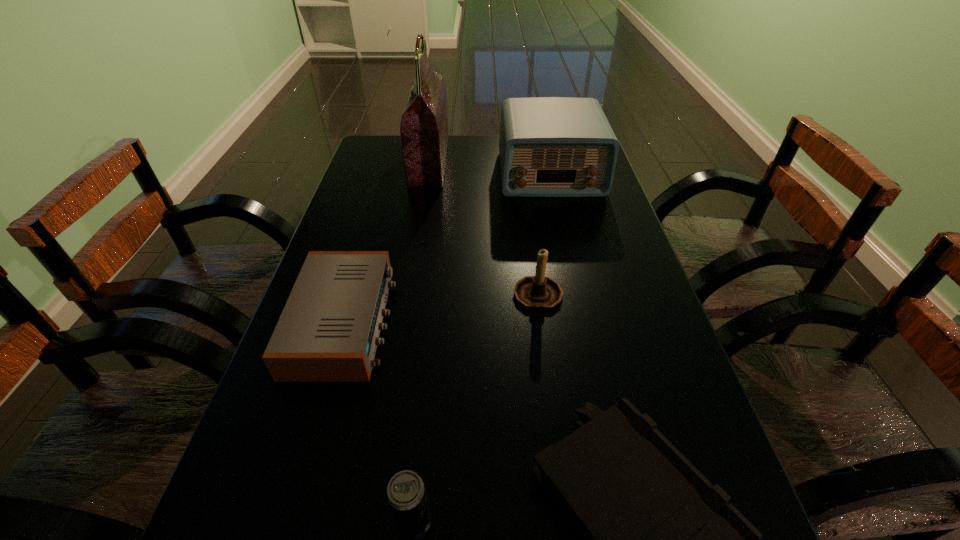
You are a GUI agent. You are given a task and a screenshot of the screen. Output one action in this format:
    pyautogui.click(x=<x>, y=<y>)
    Task: Click on the handbag
    
    Given the screenshot: What is the action you would take?
    pyautogui.click(x=424, y=134)

Locate an element on the screen. the farther radio receiver is located at coordinates (549, 146).

I want to click on the fifth shortest object, so click(549, 146).

Identify the location of candle holder. (538, 292).

This screenshot has width=960, height=540. I want to click on beer can, so click(x=406, y=495).

In order to click on the left radio receiver in this screenshot , I will do `click(328, 331)`.

Where is `the nearer radio receiver`? The image size is (960, 540). the nearer radio receiver is located at coordinates (328, 331).

This screenshot has width=960, height=540. I want to click on vacant space located on the front-facing side of the tallest object, so click(523, 161).

The width and height of the screenshot is (960, 540). Identify the location of vacant space situated 0.250m on the front panel of the taller radio receiver. (568, 254).

Find the location of a particular element. This screenshot has height=540, width=960. vacant space located on the back of the candle holder is located at coordinates (533, 254).